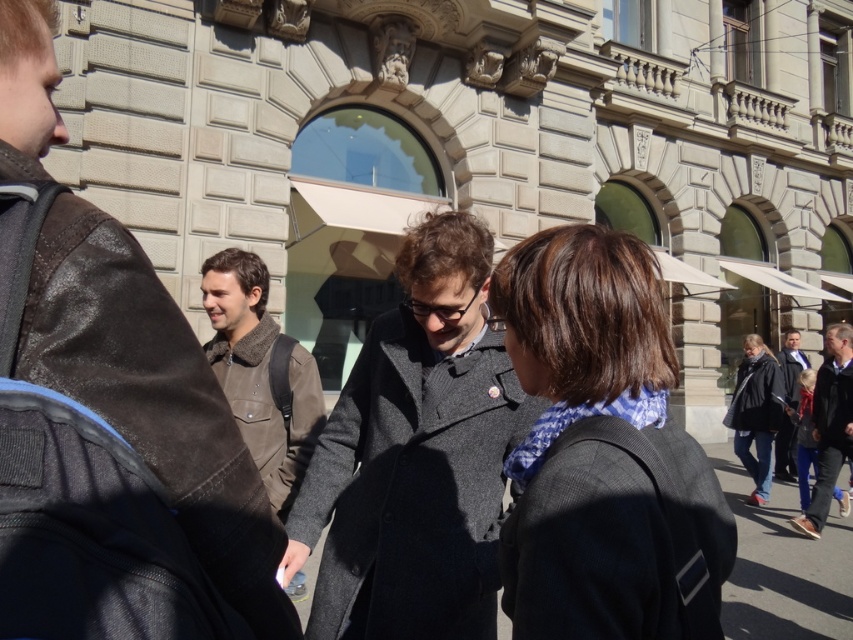
Does dark brown wool coat at center appear on the left side of brown suede jacket at center-left?

No, dark brown wool coat at center is not to the left of brown suede jacket at center-left.

Does dark brown wool coat at center appear under brown suede jacket at center-left?

Incorrect, dark brown wool coat at center is not positioned below brown suede jacket at center-left.

Is point (555, 384) less distant than point (281, 412)?

Yes, point (555, 384) is closer to viewer.

Where is `dark brown wool coat at center`? dark brown wool coat at center is located at coordinates (602, 452).

Is dark brown wool coat at center thinner than dark gray wool coat at center?

Yes.

Locate an element on the screen. The width and height of the screenshot is (853, 640). dark brown wool coat at center is located at coordinates (602, 452).

Which of these two, dark gray wool coat at center or brown suede jacket at center-left, stands shorter?

brown suede jacket at center-left is shorter.

Who is more distant from viewer, (387, 563) or (260, 400)?

Positioned behind is point (260, 400).

This screenshot has height=640, width=853. In order to click on dark gray wool coat at center in this screenshot , I will do `click(415, 456)`.